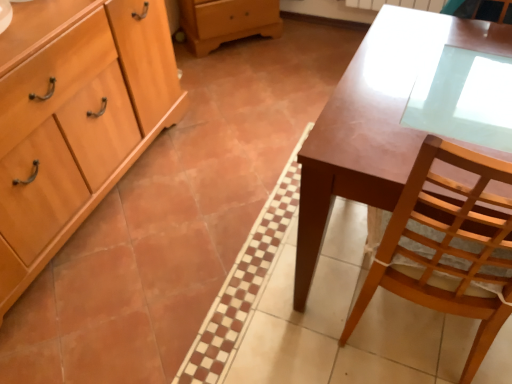
At what (x,y) coordinates should I click in order to perform the action: click on free space between light wood cabinet at left and matte brown desk at center. Please return your answer as a coordinate pair (x, y). This screenshot has width=512, height=384. Looking at the image, I should click on (195, 233).